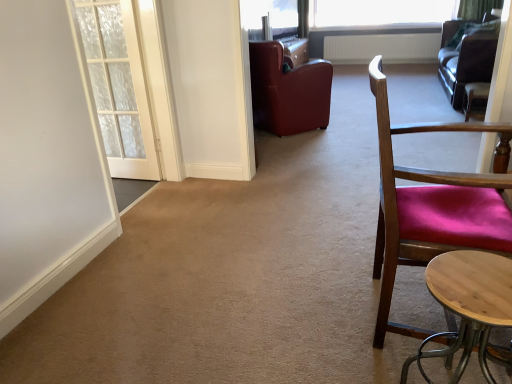
This screenshot has width=512, height=384. What are the coordinates of `blank space situated above light wood round table at lower right (from a real-world perspective)` in the screenshot? It's located at [462, 285].